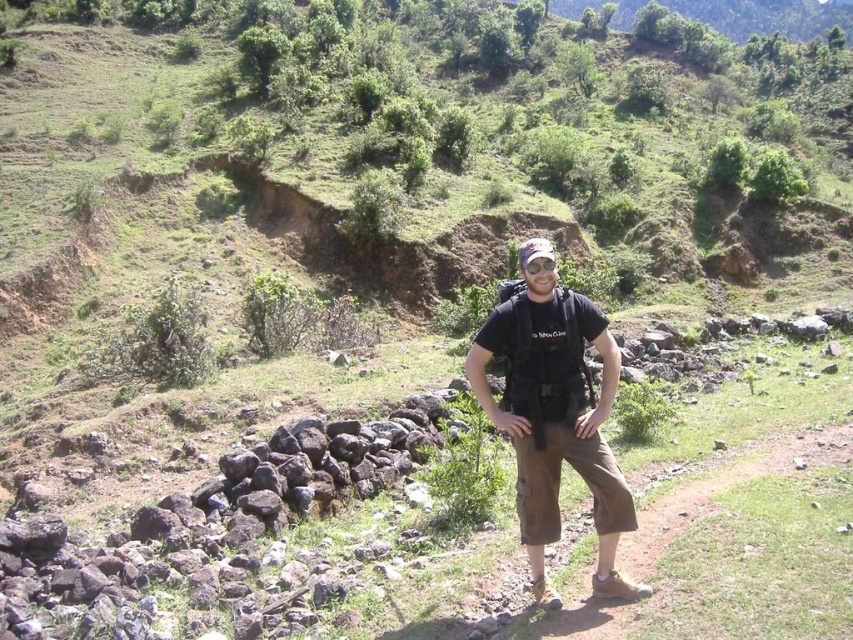
Between brown cotton cargo pants at center and brown fabric pants at center, which one has less height?

With less height is brown fabric pants at center.

In the scene shown: Between brown cotton cargo pants at center and brown fabric pants at center, which one appears on the right side from the viewer's perspective?

Positioned to the right is brown fabric pants at center.

Is point (601, 538) positioned before point (703, 512)?

Yes, it is in front of point (703, 512).

Find the location of a particular element. brown cotton cargo pants at center is located at coordinates (554, 413).